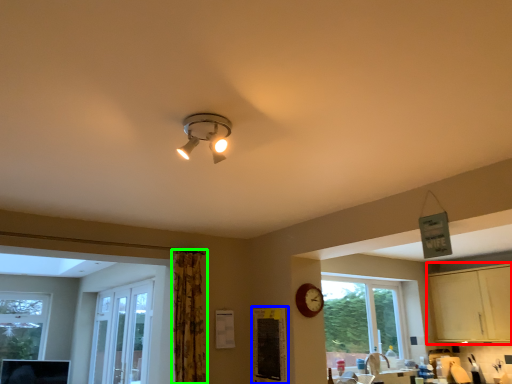
Question: Considering the real-world distances, which object is closest to dresser (highlighted by a red box)? bulletin board (highlighted by a blue box) or curtain (highlighted by a green box).

Choices:
 (A) bulletin board
 (B) curtain

Answer: (A)